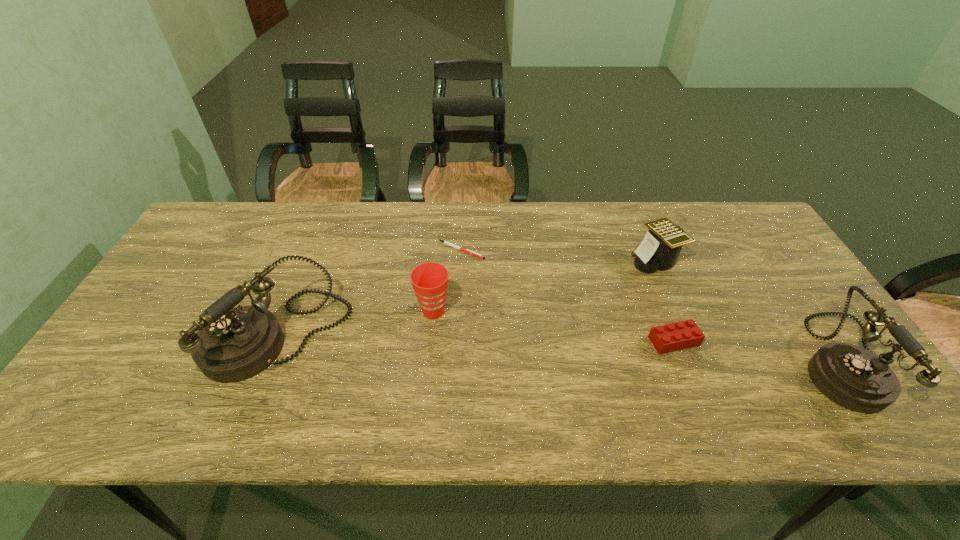
To make them evenly spaced by inserting another telephone among them, please locate a vacant spot for this new telephone. Please provide its 2D coordinates. Your answer should be formatted as a tuple, i.e. [(x, y)], where the tuple contains the x and y coordinates of a point satisfying the conditions above.

[(555, 349)]